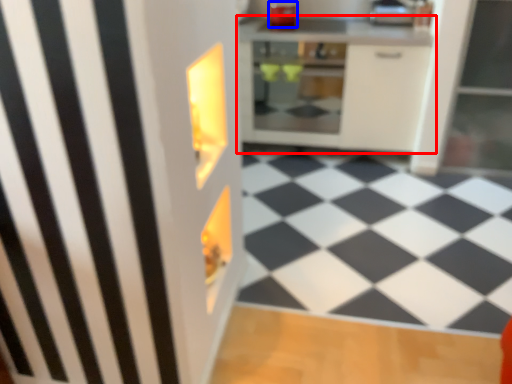
Question: Which point is closer to the camera, cabinetry (highlighted by a red box) or appliance (highlighted by a blue box)?

Choices:
 (A) cabinetry
 (B) appliance

Answer: (A)